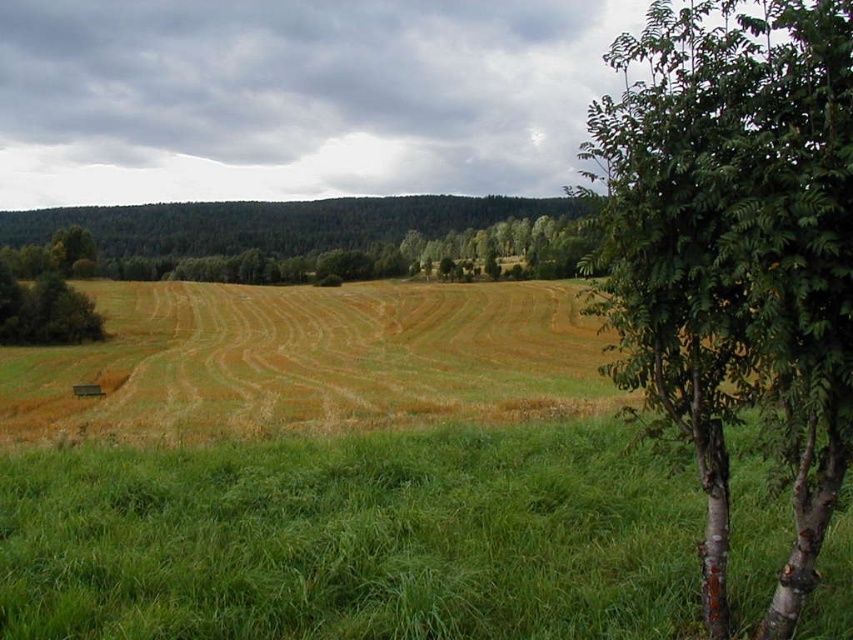
Is green grassy at lower right wider than green leafy tree at left?

No.

Measure the distance from green grassy at lower right to green leafy tree at left.

green grassy at lower right is 97.32 meters away from green leafy tree at left.

Between point (473, 563) and point (61, 337), which one is positioned behind?

The point (61, 337) is behind.

What are the coordinates of `green grassy at lower right` in the screenshot? It's located at (354, 538).

Does green grassy at lower right come behind green bark birch tree at right?

Yes.

Is green grassy at lower right below green bark birch tree at right?

Yes, green grassy at lower right is below green bark birch tree at right.

Which is behind, point (498, 522) or point (753, 168)?

Positioned behind is point (498, 522).

You are a GUI agent. You are given a task and a screenshot of the screen. Output one action in this format:
    pyautogui.click(x=<x>, y=<y>)
    Task: Click on the green grassy at lower right
    The width and height of the screenshot is (853, 640).
    Given the screenshot: What is the action you would take?
    [354, 538]

Is green bark birch tree at right to the left of green leafy tree at left from the viewer's perspective?

No, green bark birch tree at right is not to the left of green leafy tree at left.

Is point (840, 438) positioned before point (18, 282)?

Yes, point (840, 438) is in front of point (18, 282).

Looking at this image, who is more distant from viewer, (645, 358) or (41, 294)?

Point (41, 294)

Image resolution: width=853 pixels, height=640 pixels. In order to click on green bark birch tree at right in this screenshot , I will do `click(735, 250)`.